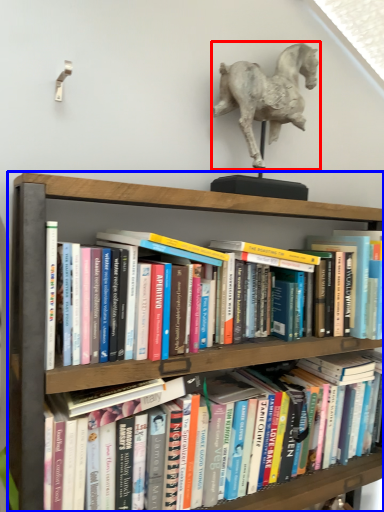
Question: Which object is closer to the camera taking this photo, horse (highlighted by a red box) or shelf (highlighted by a blue box)?

Choices:
 (A) horse
 (B) shelf

Answer: (B)